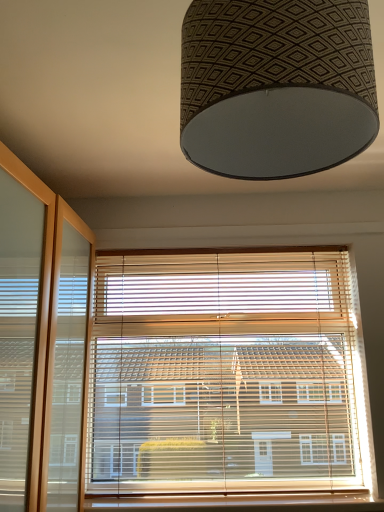
Question: Is wooden blinds at center wider or thinner than patterned fabric lampshade at upper center?

Choices:
 (A) wide
 (B) thin

Answer: (B)

Question: From the image's perspective, is wooden blinds at center above or below patterned fabric lampshade at upper center?

Choices:
 (A) below
 (B) above

Answer: (A)

Question: Considering the real-world distances, which object is closest to the wooden at lower center?

Choices:
 (A) patterned fabric lampshade at upper center
 (B) wooden blinds at center

Answer: (B)

Question: Estimate the real-world distances between objects in this image. Which object is farther from the patterned fabric lampshade at upper center?

Choices:
 (A) wooden at lower center
 (B) wooden blinds at center

Answer: (A)